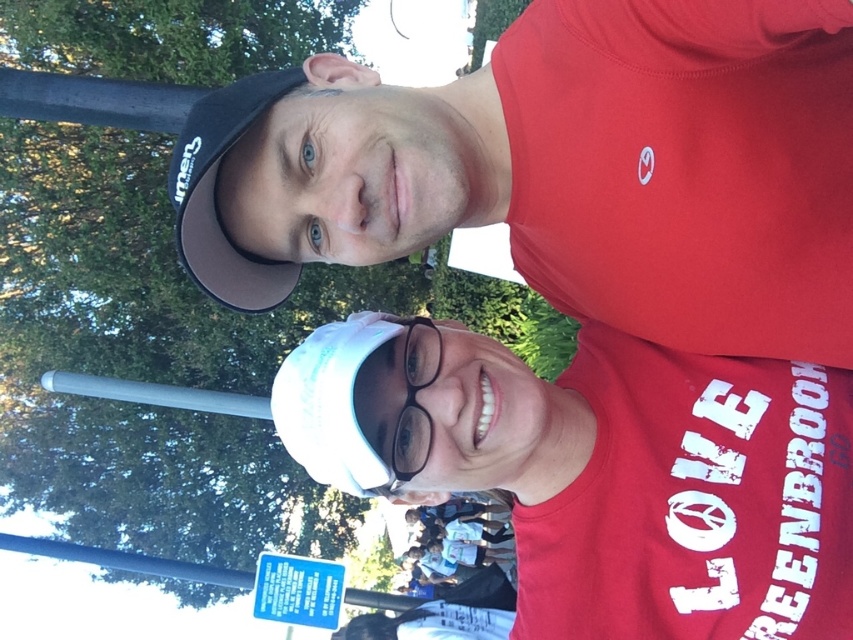
Question: Which point appears farthest from the camera in this image?

Choices:
 (A) (381, 100)
 (B) (392, 470)

Answer: (B)

Question: Is white matte cap at upper center smaller than black matte baseball cap at upper left?

Choices:
 (A) yes
 (B) no

Answer: (B)

Question: Estimate the real-world distances between objects in this image. Which object is farther from the black matte baseball cap at upper left?

Choices:
 (A) white matte cap at upper center
 (B) transparent plastic glasses at center

Answer: (A)

Question: Does black matte baseball cap at upper left have a greater width compared to transparent plastic glasses at center?

Choices:
 (A) no
 (B) yes

Answer: (B)

Question: Which point is farther to the camera?

Choices:
 (A) (177, 188)
 (B) (698, 44)

Answer: (A)

Question: Can you confirm if white matte cap at upper center is thinner than black matte baseball cap at upper left?

Choices:
 (A) no
 (B) yes

Answer: (A)